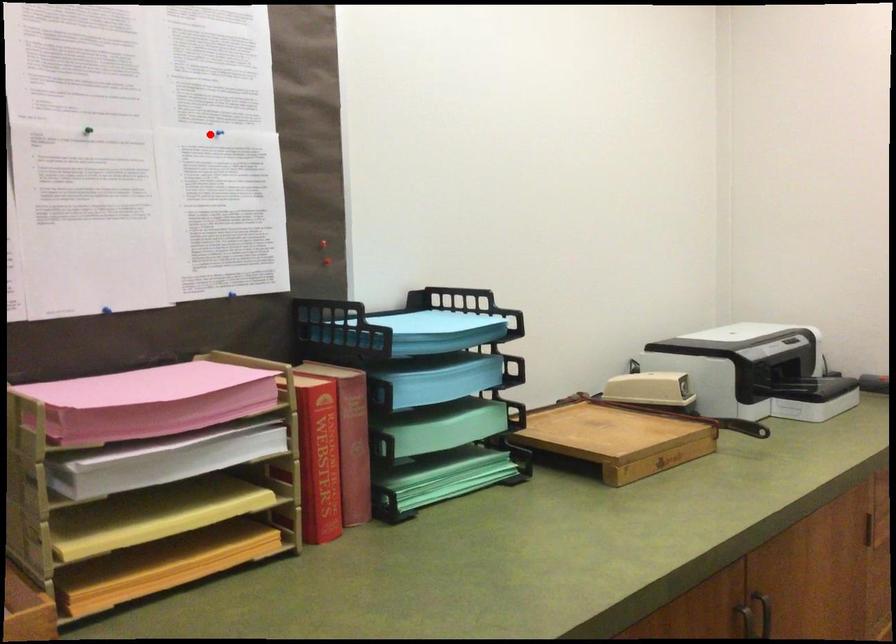
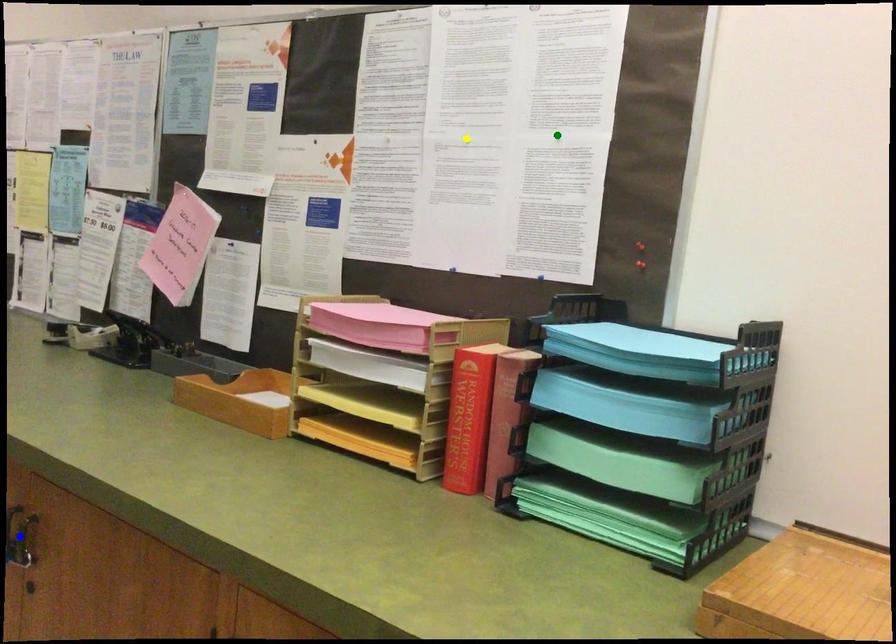
Question: I am providing you with two images of the same scene from different viewpoints. A red point is marked on the first image. You are given multiple points on the second image. In image 2, which mark is for the same physical point as the one in image 1?

Choices:
 (A) blue point
 (B) green point
 (C) yellow point

Answer: (B)